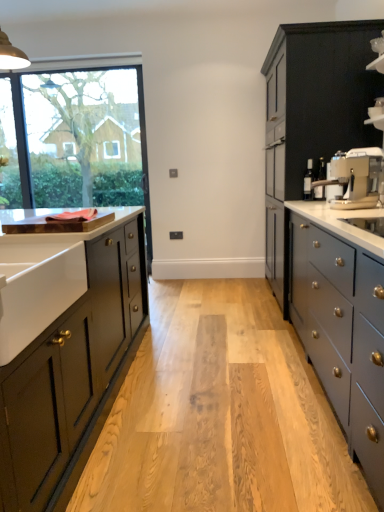
Question: Considering the positions of matte gray countertop at right and satin silver coffee machine at right in the image, is matte gray countertop at right wider or thinner than satin silver coffee machine at right?

Choices:
 (A) thin
 (B) wide

Answer: (B)

Question: Considering the positions of point (367, 263) and point (355, 175), is point (367, 263) closer or farther from the camera than point (355, 175)?

Choices:
 (A) closer
 (B) farther

Answer: (A)

Question: Considering the real-world distances, which object is closest to the matte black cabinet at left, the first cabinetry viewed from the left?

Choices:
 (A) satin silver coffee machine at right
 (B) clear glass window at upper left
 (C) matte gray countertop at right
 (D) matte black cabinet at right, the second cabinetry when ordered from front to back
 (E) white ceramic sink at left

Answer: (E)

Question: Which of these objects is positioned farthest from the brown wood cutting board at left?

Choices:
 (A) satin silver coffee machine at right
 (B) white ceramic sink at left
 (C) matte gray countertop at right
 (D) clear glass window at upper left
 (E) matte black cabinet at left, the second cabinetry from the right

Answer: (D)